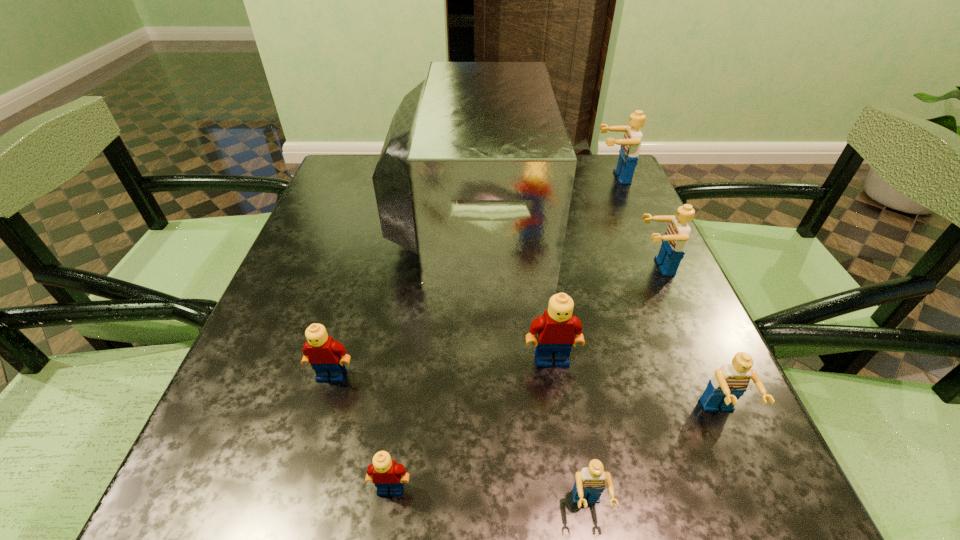
The width and height of the screenshot is (960, 540). What are the coordinates of `blank area at the left edge` in the screenshot? It's located at click(x=320, y=255).

This screenshot has height=540, width=960. Find the location of `vacant space at the right edge of the desktop`. vacant space at the right edge of the desktop is located at coordinates (711, 363).

This screenshot has height=540, width=960. In order to click on vacant space at the far left corner in this screenshot , I will do pos(337,174).

At what (x,y) coordinates should I click in order to perform the action: click on free space at the far right corner. Please return your answer as a coordinate pair (x, y). Looking at the image, I should click on (583, 168).

In the image, there is a desktop. Where is `vacant space at the near right corner`? The height and width of the screenshot is (540, 960). vacant space at the near right corner is located at coordinates (780, 525).

This screenshot has height=540, width=960. In order to click on vacant area that lies between the farthest Lego and the second yellow Lego from right to left in this screenshot , I will do `click(502, 333)`.

Identify the location of free spot between the sixth Lego from right to left and the white microwave oven. The image size is (960, 540). (431, 350).

Where is `vacant area that lies between the tallest Lego and the nearest blue Lego`? The image size is (960, 540). vacant area that lies between the tallest Lego and the nearest blue Lego is located at coordinates (600, 342).

I want to click on vacant space that's between the microwave oven and the rightmost yellow Lego, so click(512, 286).

Where is `free space that is in between the nearest yellow Lego and the second biggest yellow Lego`? This screenshot has height=540, width=960. free space that is in between the nearest yellow Lego and the second biggest yellow Lego is located at coordinates (361, 431).